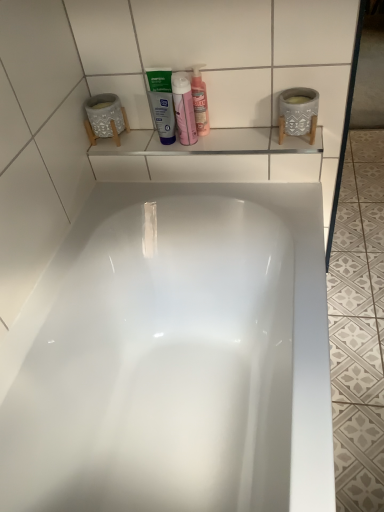
I want to click on free location to the right of white matte tube at center, so click(222, 140).